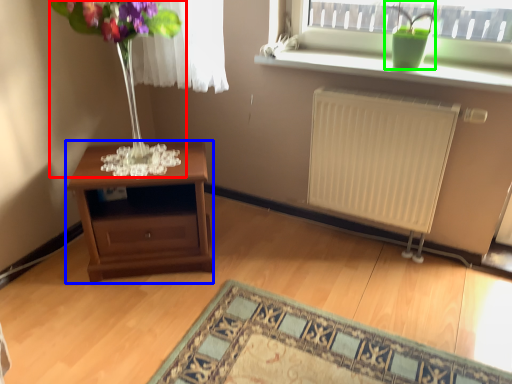
Question: Which object is the farthest from bouquet (highlighted by a red box)? Choose among these: table (highlighted by a blue box) or houseplant (highlighted by a green box).

Choices:
 (A) table
 (B) houseplant

Answer: (B)